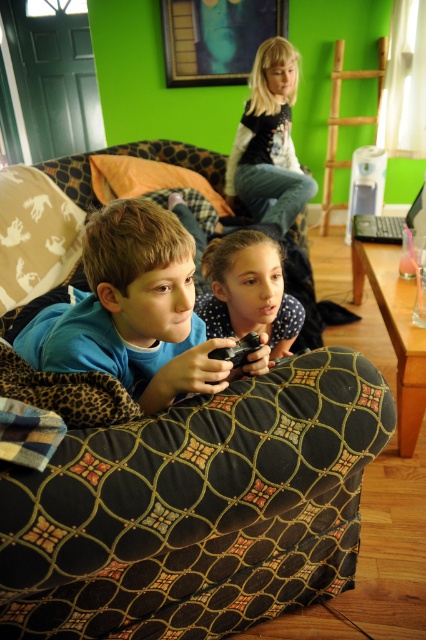
Question: Which of the following is the farthest from the observer?

Choices:
 (A) (282, 339)
 (B) (302, 513)
 (C) (150, 332)
 (D) (235, 365)

Answer: (A)

Question: Estimate the real-world distances between objects in this image. Which object is closer to the polka dot shirt at center?

Choices:
 (A) blue cotton shirt at lower left
 (B) black matte game controller at lower center
 (C) black fabric couch at lower center

Answer: (B)

Question: Does blue cotton shirt at lower left come in front of polka dot shirt at center?

Choices:
 (A) yes
 (B) no

Answer: (A)

Question: Is the position of black fabric couch at lower center more distant than that of black matte game controller at lower center?

Choices:
 (A) no
 (B) yes

Answer: (A)

Question: Is polka dot shirt at center wider than black matte game controller at lower center?

Choices:
 (A) no
 (B) yes

Answer: (B)

Question: Estimate the real-world distances between objects in this image. Which object is closer to the polka dot shirt at center?

Choices:
 (A) blue cotton shirt at lower left
 (B) black matte game controller at lower center

Answer: (B)